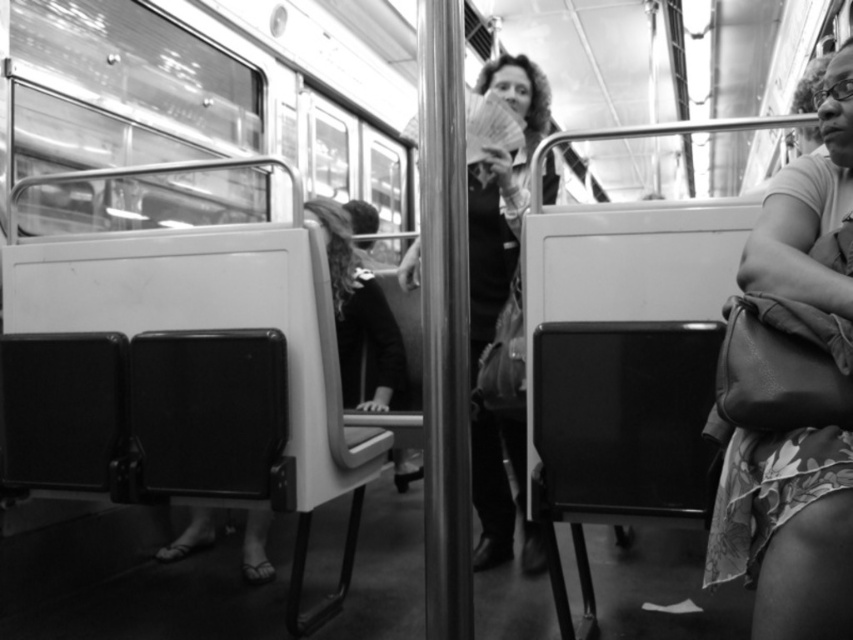
Can you confirm if leather handbag at right is positioned below matte black jacket at center?

No, leather handbag at right is not below matte black jacket at center.

Can you confirm if leather handbag at right is smaller than matte black jacket at center?

Yes.

Locate an element on the screen. leather handbag at right is located at coordinates coord(787,531).